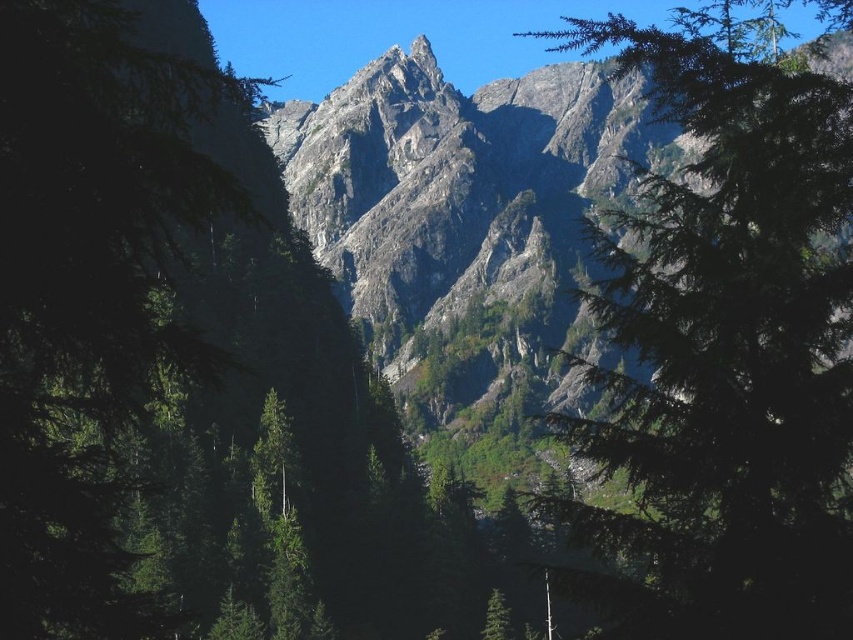
Is green matte tree at right in front of rugged stone mountain range at center?

Yes, green matte tree at right is closer to the viewer.

Is green matte tree at right to the right of rugged stone mountain range at center from the viewer's perspective?

Indeed, green matte tree at right is positioned on the right side of rugged stone mountain range at center.

This screenshot has height=640, width=853. In order to click on green matte tree at right in this screenshot , I will do `click(723, 346)`.

In order to click on green matte tree at right in this screenshot , I will do `click(723, 346)`.